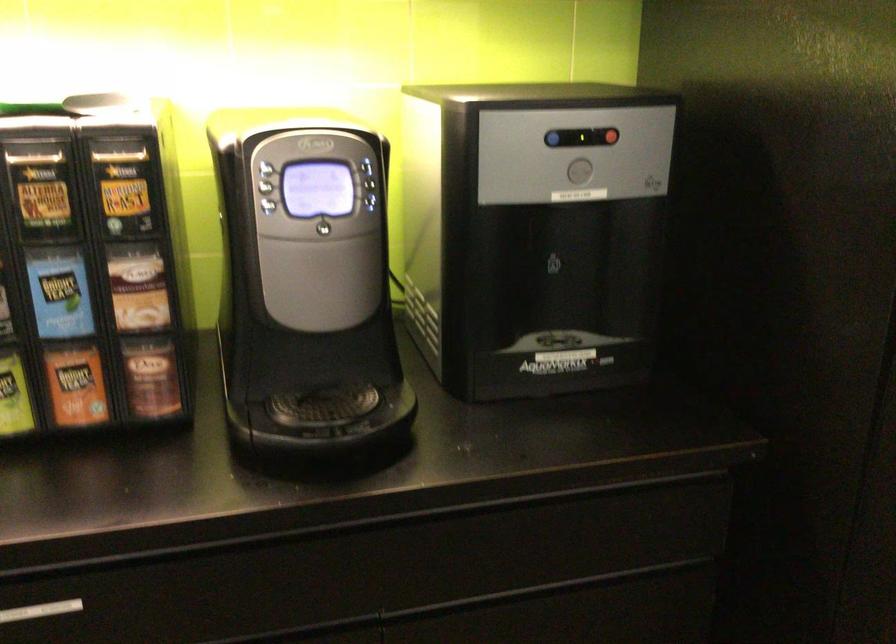
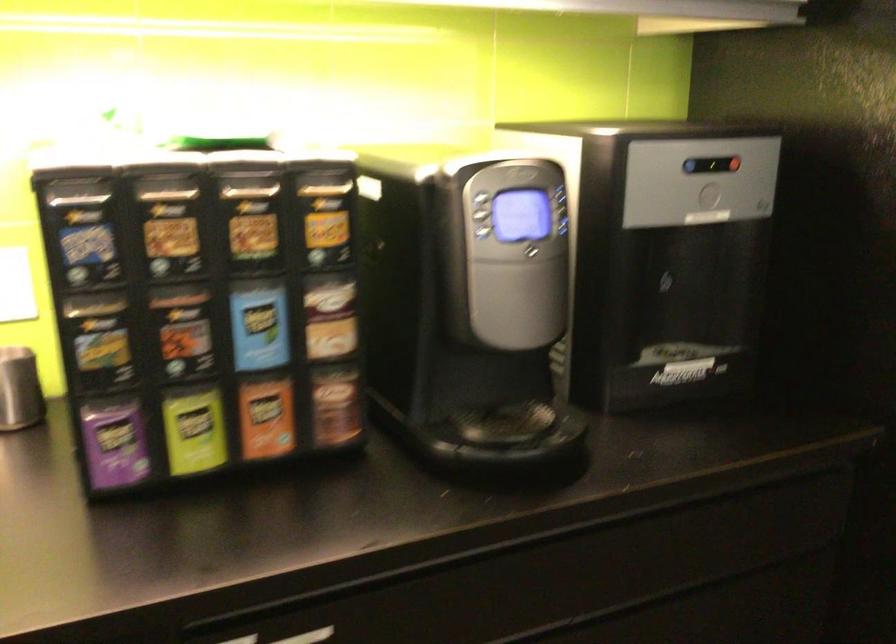
In the second image, find the point that corresponds to point 553,138 in the first image.

(691, 166)